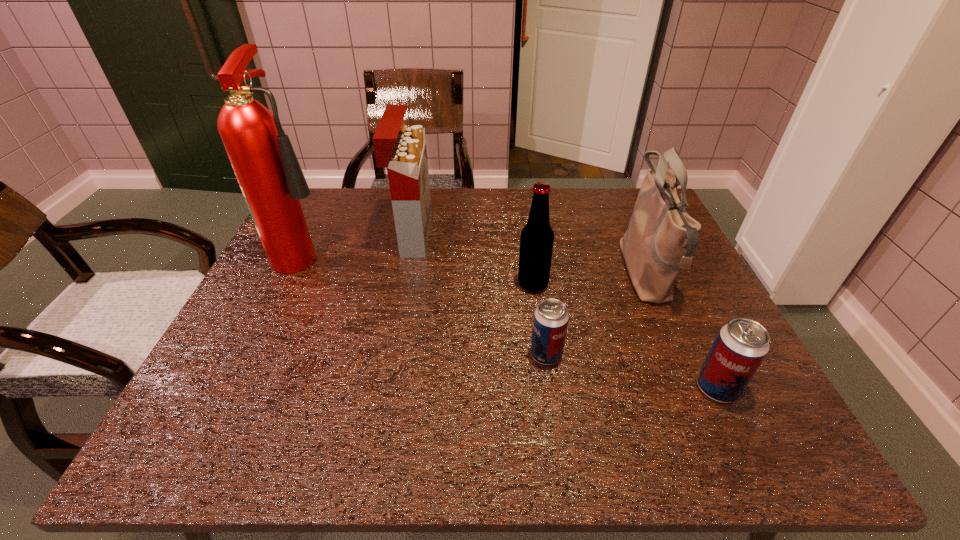
This screenshot has height=540, width=960. Find the location of `blank area located 0.130m on the back of the taller beer can`. blank area located 0.130m on the back of the taller beer can is located at coordinates (686, 325).

Find the location of a particular element. vacant space located 0.300m at the nozzle of the fire extinguisher is located at coordinates (445, 252).

At what (x,y) coordinates should I click in order to perform the action: click on vacant region located with the lid open on the cigarette case. Please return your answer as a coordinate pair (x, y). This screenshot has height=540, width=960. Looking at the image, I should click on (506, 235).

This screenshot has height=540, width=960. In order to click on vacant area situated 0.390m on the front-facing side of the shoulder bag in this screenshot , I will do `click(469, 274)`.

You are a GUI agent. You are given a task and a screenshot of the screen. Output one action in this format:
    pyautogui.click(x=<x>, y=<y>)
    Task: Click on the vacant space positioned on the front-facing side of the shoulder bag
    This screenshot has height=540, width=960.
    Given the screenshot: What is the action you would take?
    pyautogui.click(x=602, y=274)

Where is `vacant area located 0.150m on the front-facing side of the shoulder bag`? The width and height of the screenshot is (960, 540). vacant area located 0.150m on the front-facing side of the shoulder bag is located at coordinates (564, 274).

Find the location of a particular element. The width and height of the screenshot is (960, 540). free spot located on the left of the third shortest object is located at coordinates (386, 285).

Image resolution: width=960 pixels, height=540 pixels. What are the coordinates of `object at the far edge` in the screenshot? It's located at 401,149.

Find the location of a particular element. Image resolution: width=960 pixels, height=540 pixels. object that is at the near edge is located at coordinates [x=741, y=345].

Find the location of a particular element. object that is at the left edge is located at coordinates (272, 182).